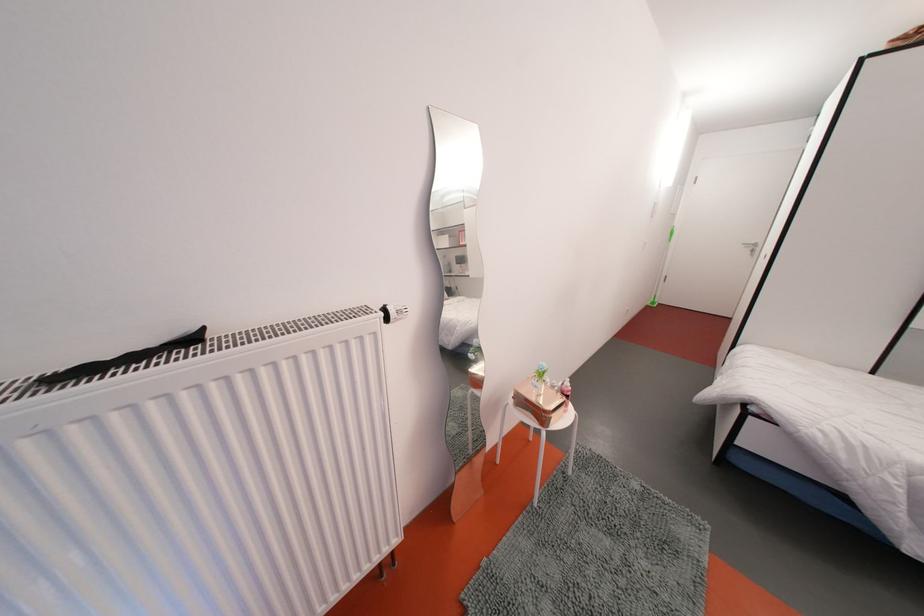
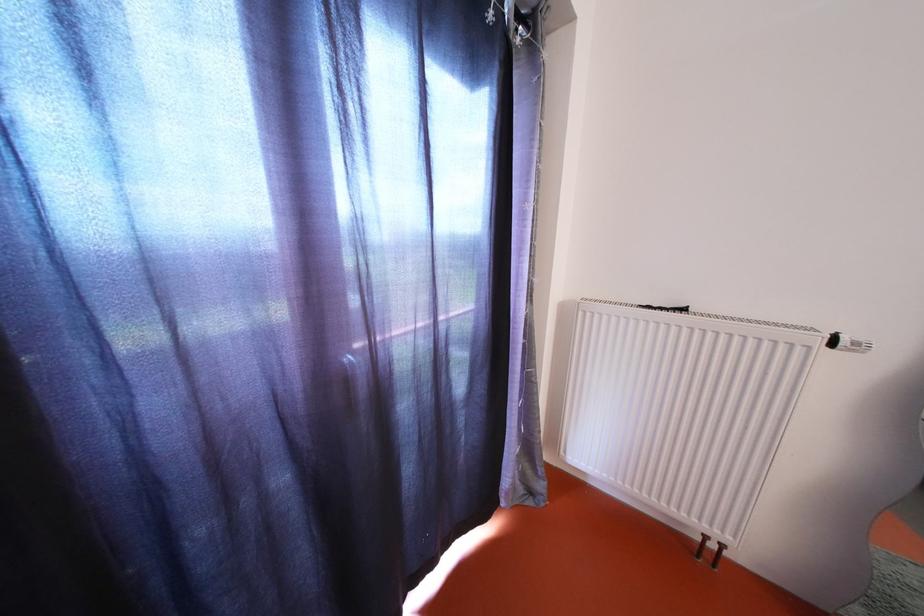
In the second image, find the point that corresponds to point (407, 317) in the first image.

(862, 349)